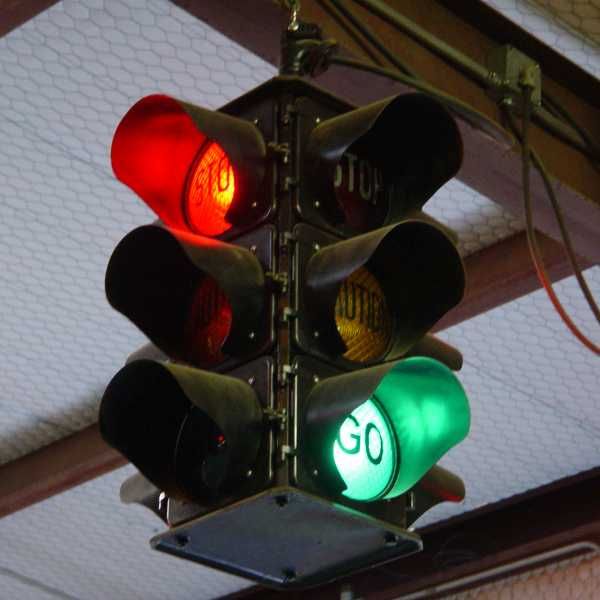
This screenshot has height=600, width=600. What are the coordinates of `yellow light` in the screenshot? It's located at (373, 323).